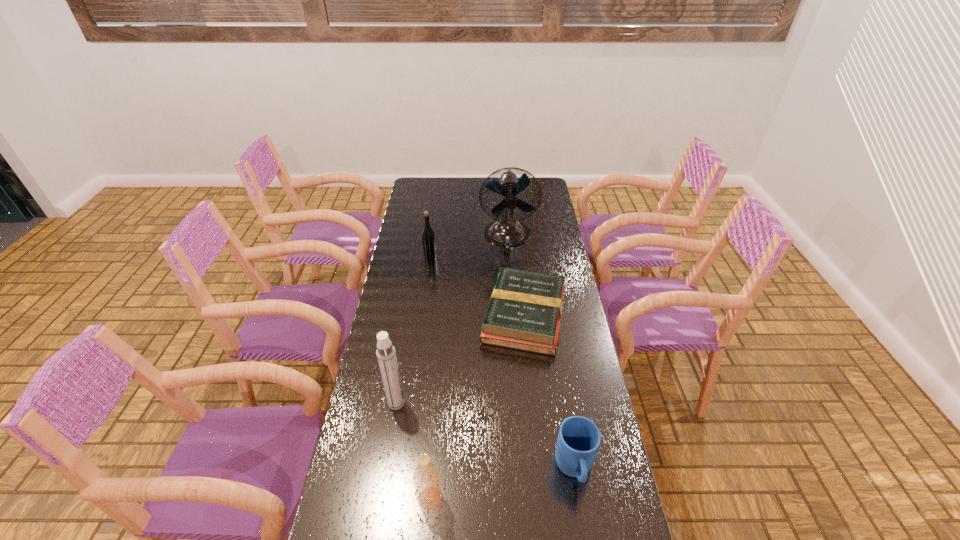
The width and height of the screenshot is (960, 540). I want to click on empty space that is in between the fourth farthest object and the mug, so click(x=486, y=436).

In order to click on vacant space in between the aerosol can and the fifth nearest object in this screenshot , I will do `click(414, 329)`.

This screenshot has height=540, width=960. What are the coordinates of `empty location between the fourth object from right to left and the farther beer bottle` in the screenshot? It's located at (430, 377).

Select which object is the fourth closest to the hardback book. Please provide its 2D coordinates. Your answer should be formatted as a tuple, i.e. [(x, y)], where the tuple contains the x and y coordinates of a point satisfying the conditions above.

[(579, 438)]

Find the location of `object identified as the fourth closest to the second shortest object`. object identified as the fourth closest to the second shortest object is located at coordinates point(506,231).

At what (x,y) coordinates should I click in order to perform the action: click on vacant area in the image that satisfies the following two spatial constraints: 1. on the front side of the farther beer bottle; 2. on the right side of the shortest object. Please return your answer as a coordinate pair (x, y). The image size is (960, 540). Looking at the image, I should click on (422, 316).

The width and height of the screenshot is (960, 540). I want to click on vacant region that satisfies the following two spatial constraints: 1. on the front-facing side of the shortest object; 2. on the left side of the tallest object, so click(514, 316).

Locate an element on the screen. This screenshot has height=540, width=960. vacant area in the image that satisfies the following two spatial constraints: 1. on the back side of the fifth shortest object; 2. on the left side of the farther beer bottle is located at coordinates (420, 256).